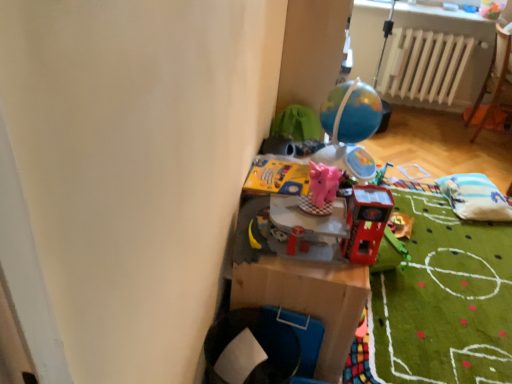
Question: Is point (373, 188) closer or farther from the camera than point (420, 56)?

Choices:
 (A) closer
 (B) farther

Answer: (A)

Question: Choose the correct answer: Is metallic red dartboard at center, the 1th toy when ordered from front to back, inside white matte radiator at upper right or outside it?

Choices:
 (A) inside
 (B) outside

Answer: (B)

Question: Estimate the real-world distances between objects in this image. Which object is farther from the metallic red dartboard at center, the 4th toy positioned from the back?

Choices:
 (A) shiny metallic globe at upper center, the 4th toy positioned from the front
 (B) white fabric bean bag at right
 (C) yellow cardboard book at center, positioned as the 2th toy in back-to-front order
 (D) white matte radiator at upper right
 (E) wooden chair at right

Answer: (D)

Question: Which object is the farthest from the metallic red dartboard at center, the 1th toy when ordered from front to back?

Choices:
 (A) white fabric bean bag at right
 (B) shiny metallic globe at upper center, arranged as the first toy when viewed from the back
 (C) yellow cardboard book at center, positioned as the 2th toy in back-to-front order
 (D) white matte radiator at upper right
 (E) pink rubber elephant at center, the 3th toy in the back-to-front sequence

Answer: (D)